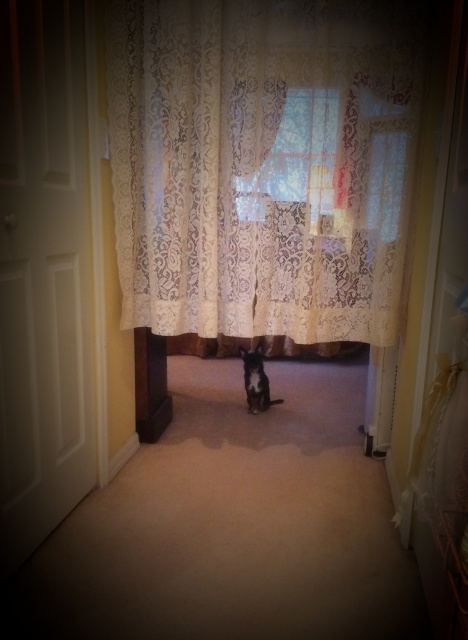
Does translucent lace curtain at center have a lesser height compared to brown wood pillar at left?

Correct, translucent lace curtain at center is not as tall as brown wood pillar at left.

Which is in front, point (247, 211) or point (138, 353)?

Point (247, 211) is in front.

Is point (291, 109) farther from viewer compared to point (163, 397)?

No, it is in front of (163, 397).

In order to click on translucent lace curtain at center in this screenshot , I will do `click(299, 163)`.

Can you confirm if white lace curtain at center is shorter than brown wood pillar at left?

No, white lace curtain at center is not shorter than brown wood pillar at left.

Is white lace curtain at center to the right of brown wood pillar at left from the viewer's perspective?

Indeed, white lace curtain at center is positioned on the right side of brown wood pillar at left.

Describe the element at coordinates (263, 163) in the screenshot. Image resolution: width=468 pixels, height=640 pixels. I see `white lace curtain at center` at that location.

Image resolution: width=468 pixels, height=640 pixels. Find the location of `white lace curtain at center`. white lace curtain at center is located at coordinates (263, 163).

Is the position of white lace curtain at center more distant than that of translucent lace curtain at center?

No, white lace curtain at center is closer to the viewer.

At what (x,y) coordinates should I click in order to perform the action: click on white lace curtain at center. Please return your answer as a coordinate pair (x, y). The height and width of the screenshot is (640, 468). Looking at the image, I should click on (263, 163).

The height and width of the screenshot is (640, 468). I want to click on white lace curtain at center, so click(x=263, y=163).